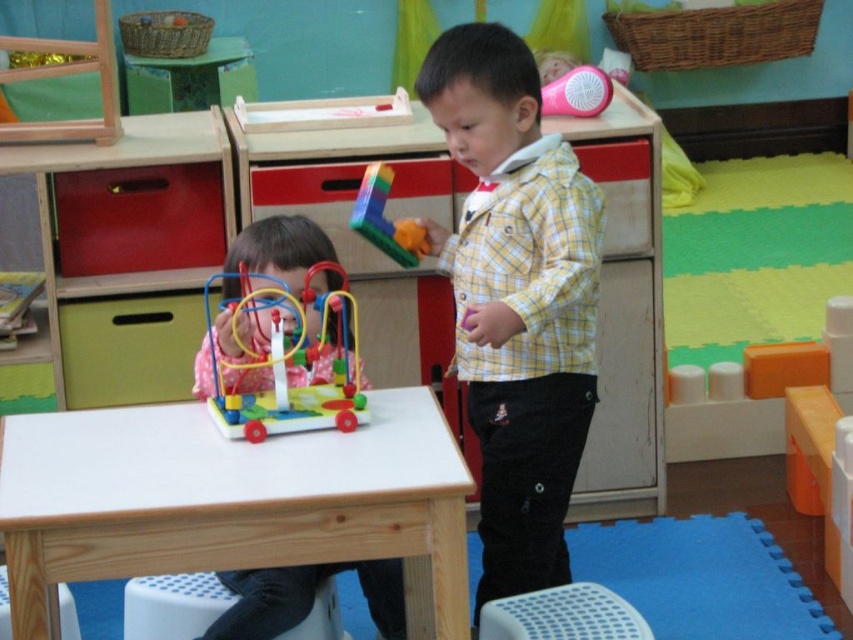
Question: Among these objects, which one is nearest to the camera?

Choices:
 (A) white wooden table at center
 (B) yellow checkered shirt at center
 (C) rubberized plastic toy at center
 (D) matte pink dress at left

Answer: (A)

Question: Which point appears farthest from the camera in this image?

Choices:
 (A) (294, 349)
 (B) (387, 168)

Answer: (B)

Question: Can you confirm if white wooden table at center is positioned to the left of rubberized plastic toy at center?

Choices:
 (A) yes
 (B) no

Answer: (A)

Question: Can you confirm if yellow checkered shirt at center is bigger than matte pink dress at left?

Choices:
 (A) yes
 (B) no

Answer: (A)

Question: Which object is positioned closest to the white plastic stool at lower left?

Choices:
 (A) multicolored plastic bead maze at left
 (B) white perforated stool at lower center
 (C) rubberized plastic toy at center
 (D) matte pink dress at left

Answer: (D)

Question: Is white wooden table at center positioned before rubberized plastic toy at center?

Choices:
 (A) no
 (B) yes

Answer: (B)